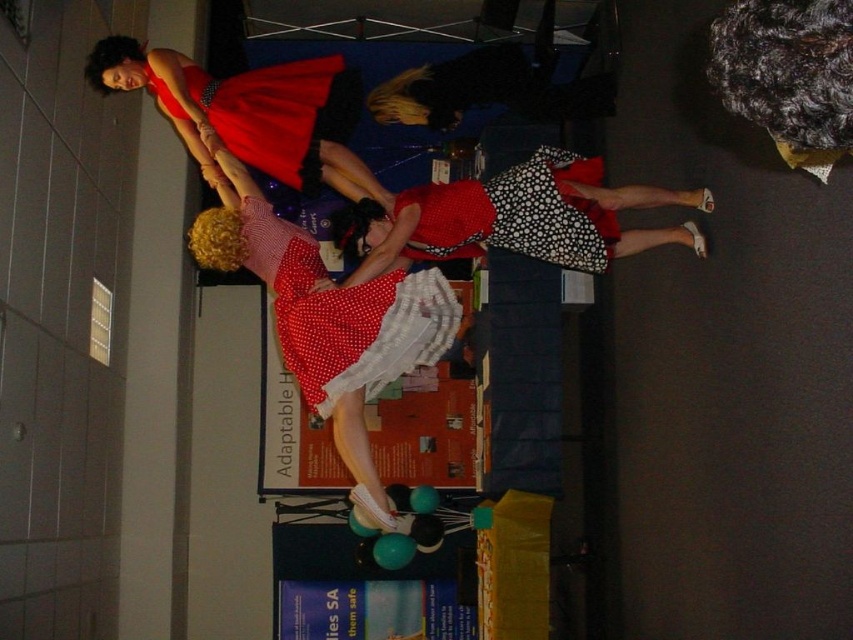
Question: Can you confirm if black dotted fabric dress at center is positioned to the right of matte red dress at upper left?

Choices:
 (A) no
 (B) yes

Answer: (B)

Question: Can you confirm if black dotted fabric dress at center is bigger than matte red dress at upper left?

Choices:
 (A) no
 (B) yes

Answer: (B)

Question: Which point is farther from the camera taking this photo?

Choices:
 (A) (157, 83)
 (B) (318, 320)
 (C) (286, 257)
 (D) (599, 177)

Answer: (D)

Question: Which of the following is the closest to the observer?

Choices:
 (A) (587, 250)
 (B) (302, 321)
 (C) (258, 218)
 (D) (314, 97)

Answer: (B)

Question: Considering the relative positions of polka dot fabric dress at center and matte red dress at upper left in the image provided, where is polka dot fabric dress at center located with respect to matte red dress at upper left?

Choices:
 (A) left
 (B) right

Answer: (B)

Question: Among these objects, which one is farthest from the camera?

Choices:
 (A) red polka dot fabric dress at center
 (B) polka dot fabric dress at center
 (C) black dotted fabric dress at center
 (D) matte red dress at upper left

Answer: (D)